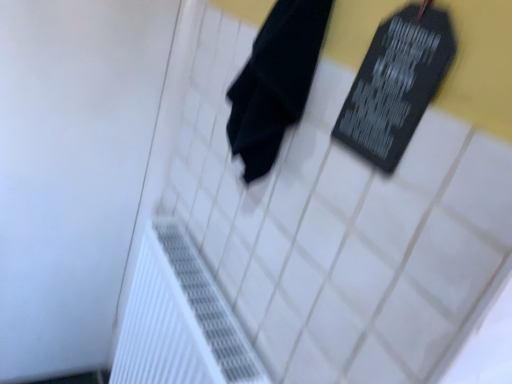
Question: From the image's perspective, is black matte board at upper right below white textured radiator at lower left?

Choices:
 (A) yes
 (B) no

Answer: (B)

Question: Are black matte board at upper right and white textured radiator at lower left beside each other?

Choices:
 (A) yes
 (B) no

Answer: (B)

Question: Does black matte board at upper right have a greater height compared to white textured radiator at lower left?

Choices:
 (A) yes
 (B) no

Answer: (B)

Question: Considering the relative positions of black matte board at upper right and white textured radiator at lower left in the image provided, is black matte board at upper right in front of white textured radiator at lower left?

Choices:
 (A) yes
 (B) no

Answer: (A)

Question: Does black matte board at upper right have a smaller size compared to white textured radiator at lower left?

Choices:
 (A) yes
 (B) no

Answer: (A)

Question: Would you say black matte towel at center is inside or outside white textured radiator at lower left?

Choices:
 (A) inside
 (B) outside

Answer: (B)

Question: Is black matte towel at center wider or thinner than white textured radiator at lower left?

Choices:
 (A) wide
 (B) thin

Answer: (B)

Question: Looking at the image, does black matte towel at center seem bigger or smaller compared to white textured radiator at lower left?

Choices:
 (A) small
 (B) big

Answer: (A)

Question: Is black matte towel at center taller or shorter than white textured radiator at lower left?

Choices:
 (A) short
 (B) tall

Answer: (A)

Question: In terms of width, does white textured radiator at lower left look wider or thinner when compared to black matte towel at center?

Choices:
 (A) thin
 (B) wide

Answer: (B)

Question: In terms of size, does white textured radiator at lower left appear bigger or smaller than black matte towel at center?

Choices:
 (A) big
 (B) small

Answer: (A)

Question: In the image, is white textured radiator at lower left on the left side or the right side of black matte towel at center?

Choices:
 (A) right
 (B) left

Answer: (B)

Question: Is point (142, 382) positioned closer to the camera than point (245, 114)?

Choices:
 (A) farther
 (B) closer

Answer: (A)

Question: Does point (274, 8) appear closer or farther from the camera than point (358, 127)?

Choices:
 (A) farther
 (B) closer

Answer: (A)

Question: In terms of height, does black matte towel at center look taller or shorter compared to black matte board at upper right?

Choices:
 (A) tall
 (B) short

Answer: (B)